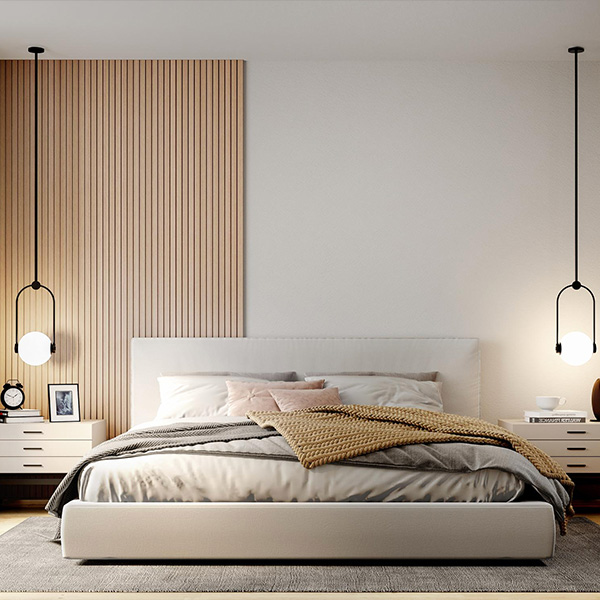
I want to click on headboard, so click(332, 351).